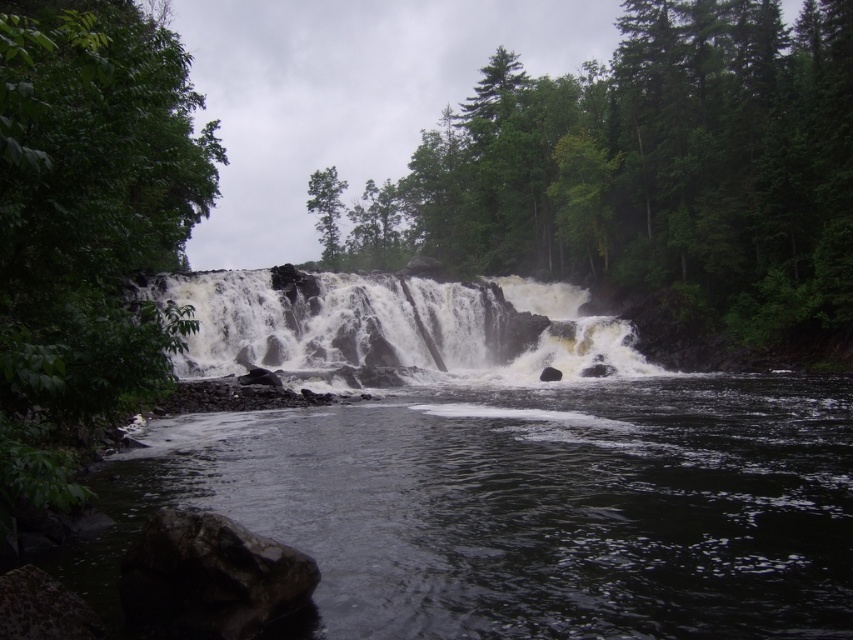
Question: Considering the real-world distances, which object is closest to the dark gray rock at lower left?

Choices:
 (A) green leafy tree at upper center
 (B) dark brown rock at center

Answer: (B)

Question: In this image, where is dark brown rock at center located relative to dark gray rock at lower left?

Choices:
 (A) above
 (B) below

Answer: (A)

Question: Which point is farther to the camera?

Choices:
 (A) (190, 634)
 (B) (583, 93)

Answer: (B)

Question: Does green leafy tree at center appear under dark brown rock at center?

Choices:
 (A) no
 (B) yes

Answer: (A)

Question: Where is dark water at center located in relation to dark gray rock at lower left in the image?

Choices:
 (A) right
 (B) left

Answer: (A)

Question: Which of the following is the closest to the observer?

Choices:
 (A) (556, 451)
 (B) (166, 291)
 (C) (316, 195)

Answer: (A)